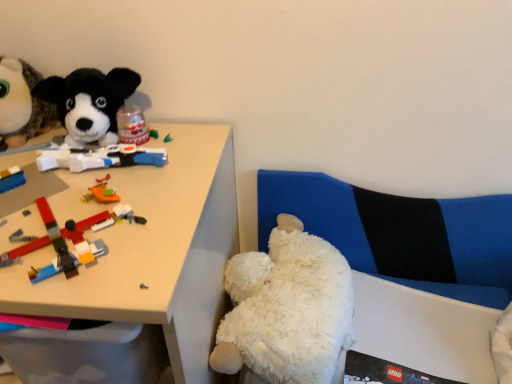
Question: Does white plastic desk at upper left have a lesser height compared to white plush couch at lower right?

Choices:
 (A) yes
 (B) no

Answer: (B)

Question: Is white plastic desk at upper left at the left side of white plush couch at lower right?

Choices:
 (A) yes
 (B) no

Answer: (A)

Question: From the image's perspective, is white plastic desk at upper left on white plush couch at lower right?

Choices:
 (A) yes
 (B) no

Answer: (B)

Question: Could you tell me if white plastic desk at upper left is facing white plush couch at lower right?

Choices:
 (A) no
 (B) yes

Answer: (A)

Question: Can you confirm if white plastic desk at upper left is wider than white plush couch at lower right?

Choices:
 (A) no
 (B) yes

Answer: (B)

Question: Considering the relative positions of black plush dog at upper left, the 1th toy viewed from the top, and brick-like plastic toys at left, placed as the 2th toy when sorted from bottom to top, in the image provided, is black plush dog at upper left, the 1th toy viewed from the top, to the left or to the right of brick-like plastic toys at left, placed as the 2th toy when sorted from bottom to top,?

Choices:
 (A) left
 (B) right

Answer: (A)

Question: Is black plush dog at upper left, positioned as the 3th toy in bottom-to-top order, wider or thinner than brick-like plastic toys at left, which is the second toy from right to left?

Choices:
 (A) thin
 (B) wide

Answer: (A)

Question: From the image's perspective, relative to brick-like plastic toys at left, which is the 2th toy from top to bottom, is black plush dog at upper left, positioned as the 3th toy in bottom-to-top order, above or below?

Choices:
 (A) below
 (B) above

Answer: (B)

Question: From their relative heights in the image, would you say black plush dog at upper left, the 1th toy positioned from the left, is taller or shorter than brick-like plastic toys at left, which is the second toy from right to left?

Choices:
 (A) short
 (B) tall

Answer: (B)

Question: From a real-world perspective, is white plush couch at lower right above or below white fluffy teddy bear at lower right, the third toy viewed from the left?

Choices:
 (A) below
 (B) above

Answer: (A)

Question: In the image, is white plush couch at lower right positioned in front of or behind white fluffy teddy bear at lower right, acting as the 3th toy starting from the top?

Choices:
 (A) front
 (B) behind

Answer: (B)

Question: Considering the relative positions of white plush couch at lower right and white fluffy teddy bear at lower right, which ranks as the first toy in bottom-to-top order, in the image provided, is white plush couch at lower right to the left or to the right of white fluffy teddy bear at lower right, which ranks as the first toy in bottom-to-top order,?

Choices:
 (A) right
 (B) left

Answer: (A)

Question: Is white plush couch at lower right wider or thinner than white fluffy teddy bear at lower right, the third toy viewed from the left?

Choices:
 (A) thin
 (B) wide

Answer: (A)

Question: From a real-world perspective, is white plush couch at lower right physically located above or below black plush dog at upper left, the 1th toy positioned from the left?

Choices:
 (A) below
 (B) above

Answer: (A)

Question: Is white plush couch at lower right inside the boundaries of black plush dog at upper left, acting as the 3th toy starting from the right, or outside?

Choices:
 (A) inside
 (B) outside

Answer: (B)